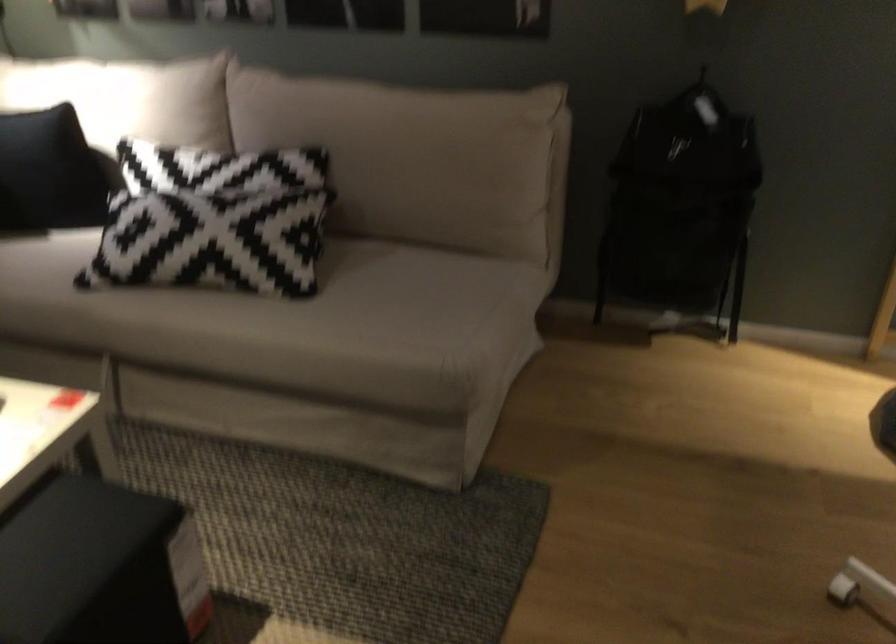
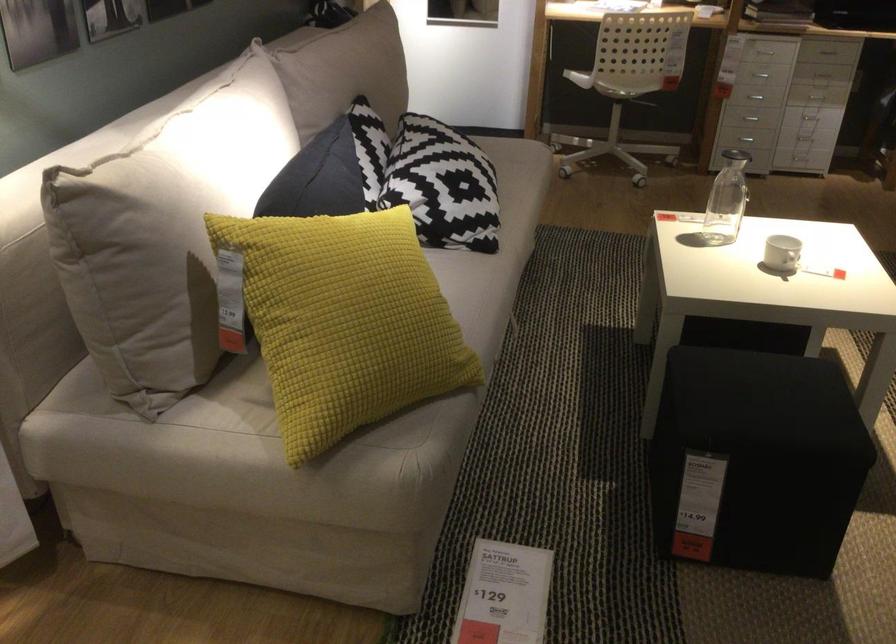
Locate, in the second image, the point that corresponds to (x=184, y=227) in the first image.

(442, 185)